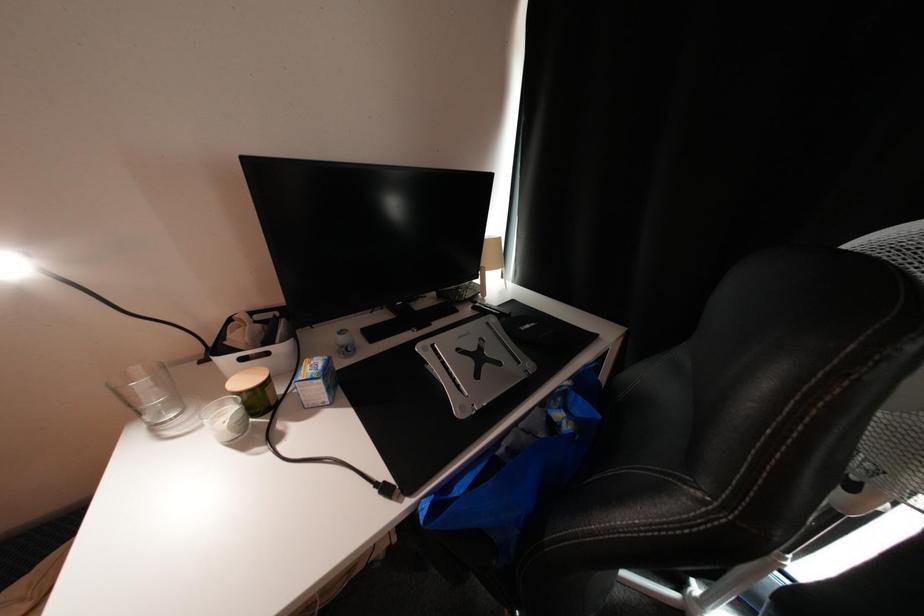
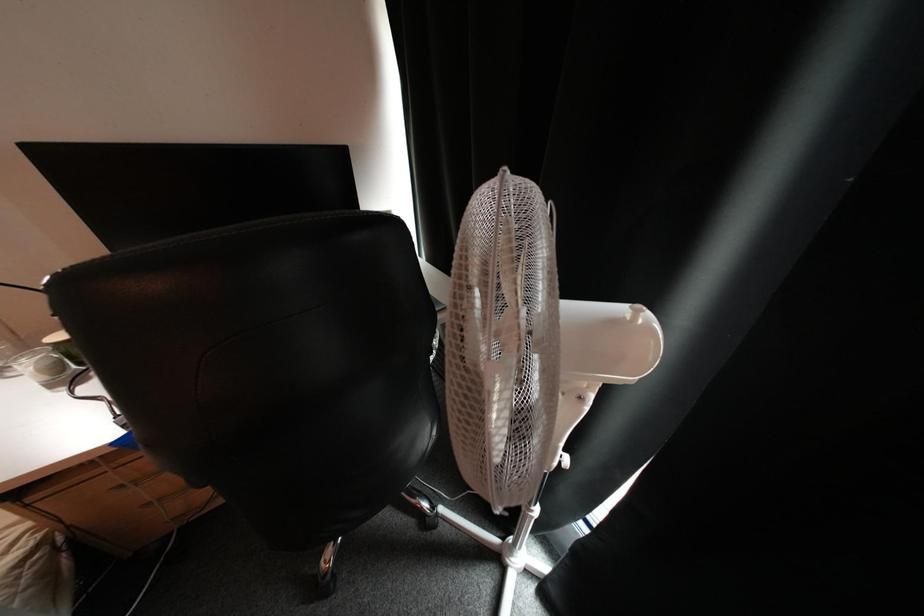
Question: Which direction would the cameraman need to move to produce the second image? Reply with the corresponding letter.

Choices:
 (A) Left
 (B) Right
 (C) Forward
 (D) Backward

Answer: (B)